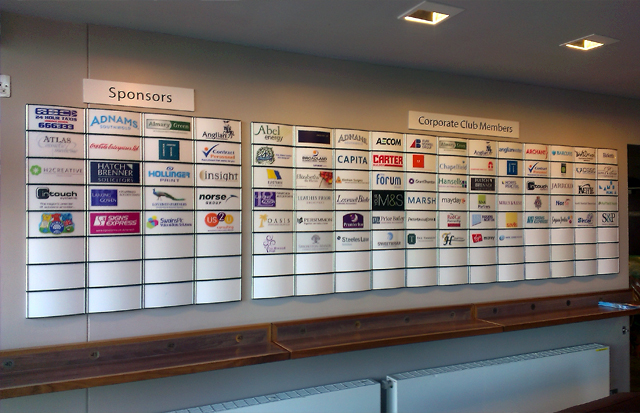
Find the location of a particular element. This screenshot has width=640, height=413. outlets is located at coordinates (3, 85).